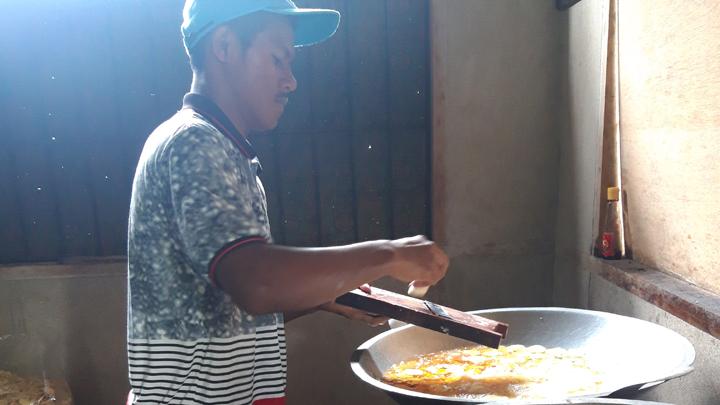
Identify the location of dirty, old walls. This screenshot has width=720, height=405. (680, 247), (667, 87), (499, 234), (508, 99), (615, 299), (698, 385), (495, 282).